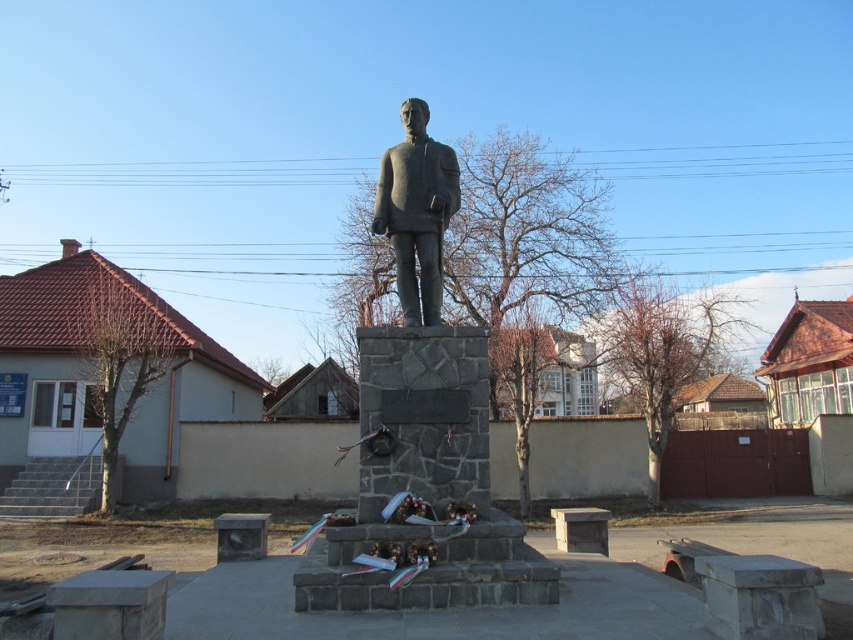
You are standing at the statue in the public square and want to walk towards the point labeled as point (x=466, y=369). Which direction should you move relative to the other point, point (x=412, y=220)?

Since point (x=466, y=369) is in front of point (x=412, y=220), you should move forward towards it while facing away from point (x=412, y=220).